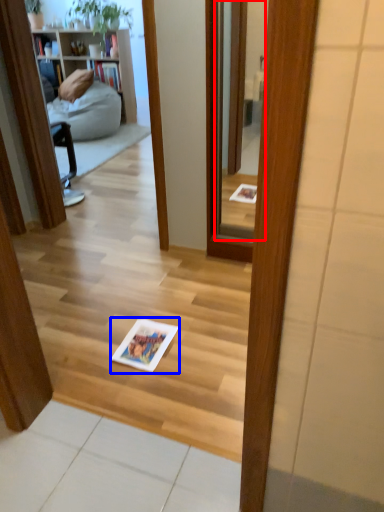
Question: Which of the following is the farthest to the observer, mirror (highlighted by a red box) or book (highlighted by a blue box)?

Choices:
 (A) mirror
 (B) book

Answer: (A)